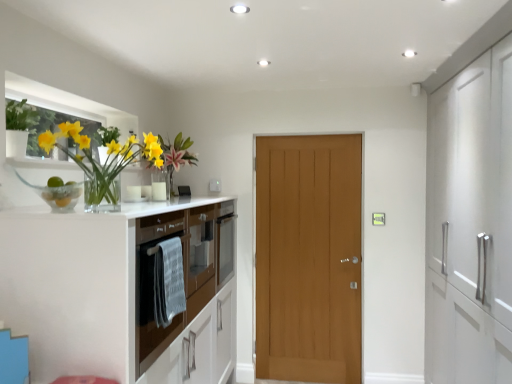
Question: In terms of width, does green matte plant at upper left look wider or thinner when compared to brown glossy oven at left?

Choices:
 (A) thin
 (B) wide

Answer: (A)

Question: Is green matte plant at upper left in front of or behind brown glossy oven at left in the image?

Choices:
 (A) front
 (B) behind

Answer: (B)

Question: Based on their relative distances, which object is nearer to the light brown wood door at center?

Choices:
 (A) green matte plant at upper left
 (B) brown glossy oven at left
 (C) translucent glass vase at left

Answer: (B)

Question: Which object is the closest to the brown glossy oven at left?

Choices:
 (A) green matte plant at upper left
 (B) translucent glass vase at left
 (C) light brown wood door at center

Answer: (B)